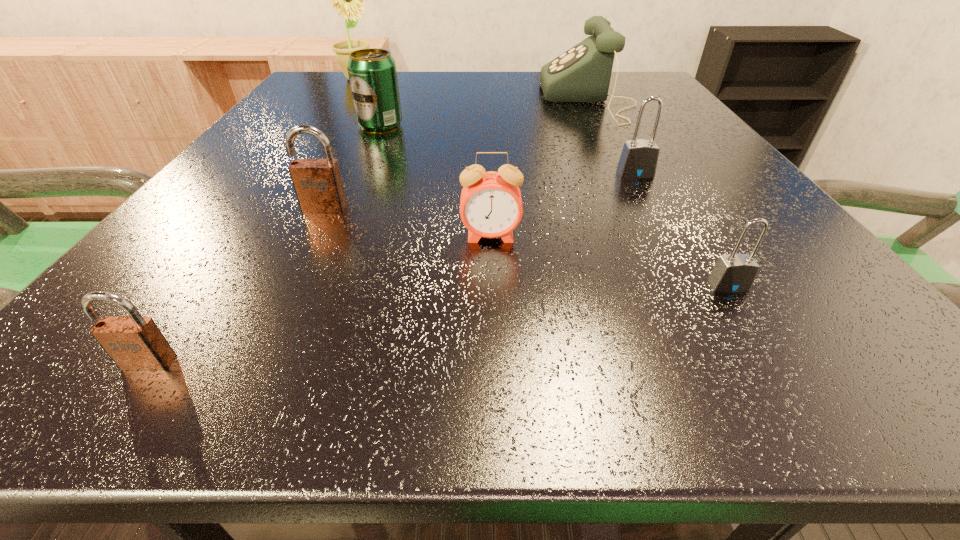
Identify the location of vacant area that lies between the beer can and the fifth farthest object. This screenshot has width=960, height=540. (352, 167).

The width and height of the screenshot is (960, 540). Find the location of `vacant space in between the telephone and the leftmost padlock`. vacant space in between the telephone and the leftmost padlock is located at coordinates (369, 231).

The width and height of the screenshot is (960, 540). In order to click on vacant point located between the second nearest object and the second padlock from left to right in this screenshot , I will do `click(526, 247)`.

The height and width of the screenshot is (540, 960). I want to click on blank region between the nearer gray padlock and the yellow sunflower, so click(x=542, y=182).

Locate which object ranks fourth in proximity to the pink alarm clock. Please provide its 2D coordinates. Your answer should be formatted as a tuple, i.e. [(x, y)], where the tuple contains the x and y coordinates of a point satisfying the conditions above.

[(134, 343)]

Choose which object is the second nearest neighbor to the alarm clock. Please provide its 2D coordinates. Your answer should be formatted as a tuple, i.e. [(x, y)], where the tuple contains the x and y coordinates of a point satisfying the conditions above.

[(639, 158)]

Where is `padlock that is the third closest to the tallest object`? The width and height of the screenshot is (960, 540). padlock that is the third closest to the tallest object is located at coordinates (134, 343).

Choose which padlock is the nearest neighbor to the tallest object. Please provide its 2D coordinates. Your answer should be formatted as a tuple, i.e. [(x, y)], where the tuple contains the x and y coordinates of a point satisfying the conditions above.

[(318, 185)]

This screenshot has width=960, height=540. I want to click on vacant point that satisfies the following two spatial constraints: 1. on the dial of the telephone; 2. on the face of the third nearest object, so click(x=660, y=237).

At what (x,y) coordinates should I click in order to perform the action: click on free location that satisfies the following two spatial constraints: 1. on the face of the tallest object; 2. on the right side of the beer can. Please return your answer as a coordinate pair (x, y). Looking at the image, I should click on (326, 125).